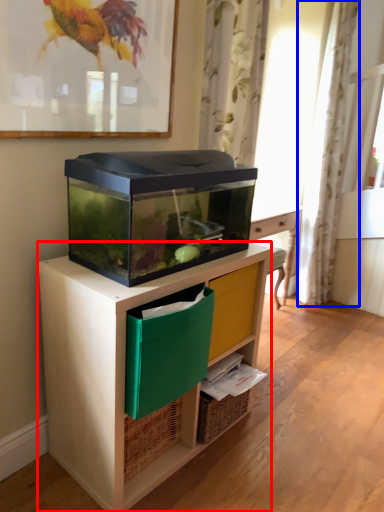
Question: Which object is closer to the camera taking this photo, desk (highlighted by a red box) or curtain (highlighted by a blue box)?

Choices:
 (A) desk
 (B) curtain

Answer: (A)